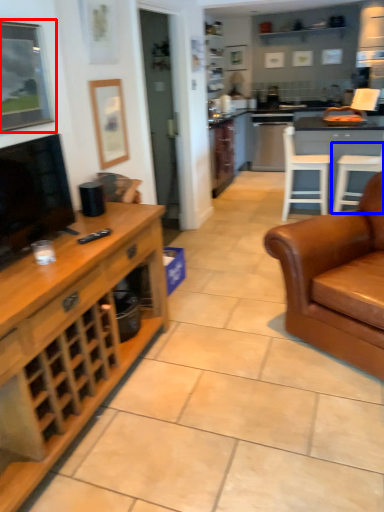
Question: Which object is closer to the camera taking this photo, picture frame (highlighted by a red box) or chair (highlighted by a blue box)?

Choices:
 (A) picture frame
 (B) chair

Answer: (A)